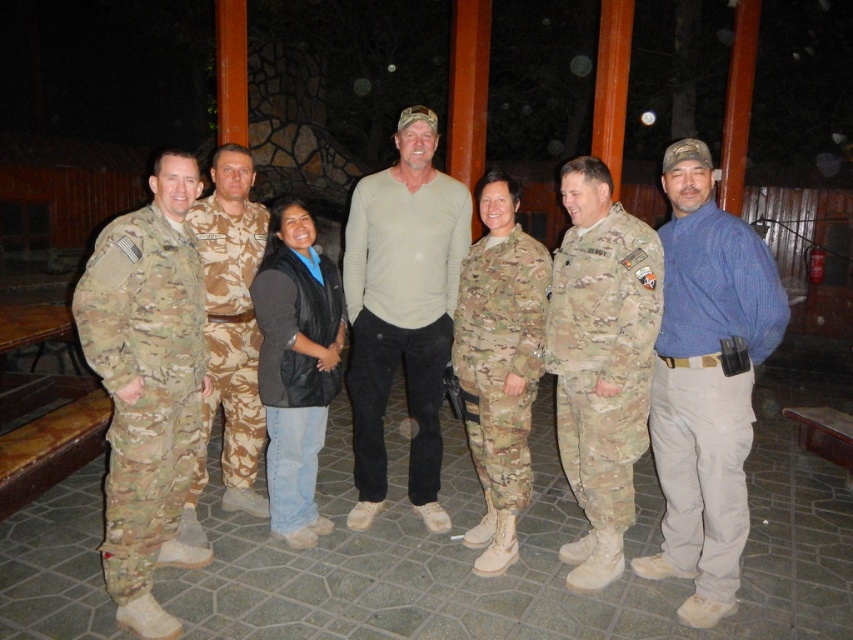
Does point (167, 392) come behind point (451, 193)?

No, (167, 392) is in front of (451, 193).

Who is positioned more to the right, camouflage fabric uniform at left or beige cotton shirt at center?

From the viewer's perspective, beige cotton shirt at center appears more on the right side.

Identify the location of camouflage fabric uniform at left. (144, 381).

Does camouflage fabric uniform at center have a lesser height compared to black leather vest at center?

Incorrect, camouflage fabric uniform at center's height does not fall short of black leather vest at center's.

Who is higher up, camouflage fabric uniform at center or black leather vest at center?

camouflage fabric uniform at center is higher up.

Who is more distant from viewer, (604,444) or (335,392)?

The point (335,392) is behind.

Where is `camouflage fabric uniform at center`? camouflage fabric uniform at center is located at coordinates 602,356.

Consider the image. Which is above, blue plaid shirt at center or camouflage fabric uniform at left?

blue plaid shirt at center

Can you confirm if blue plaid shirt at center is positioned to the left of camouflage fabric uniform at left?

In fact, blue plaid shirt at center is to the right of camouflage fabric uniform at left.

In the scene shown: Measure the distance between point (775, 305) and camera.

Point (775, 305) is 2.74 meters from camera.

This screenshot has width=853, height=640. Identify the location of blue plaid shirt at center. (706, 381).